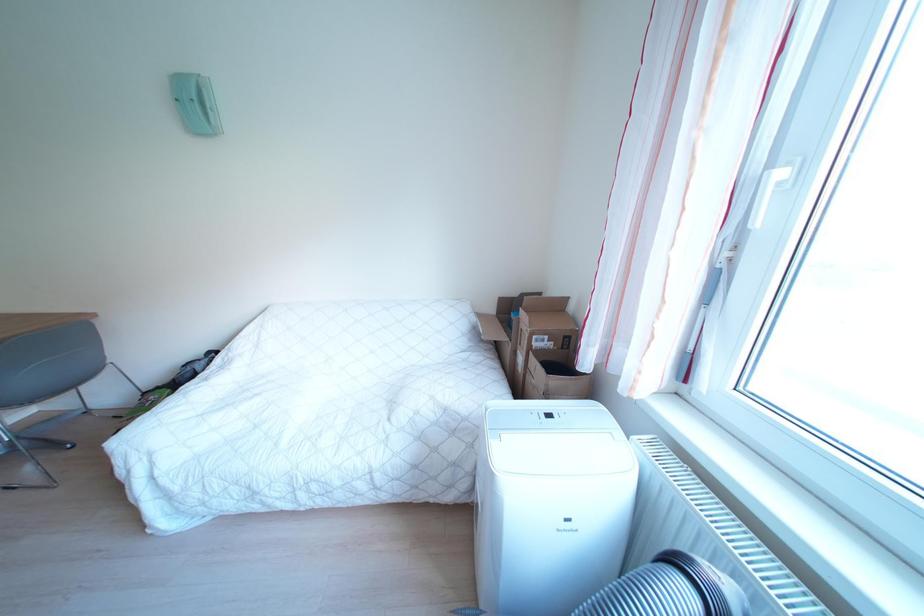
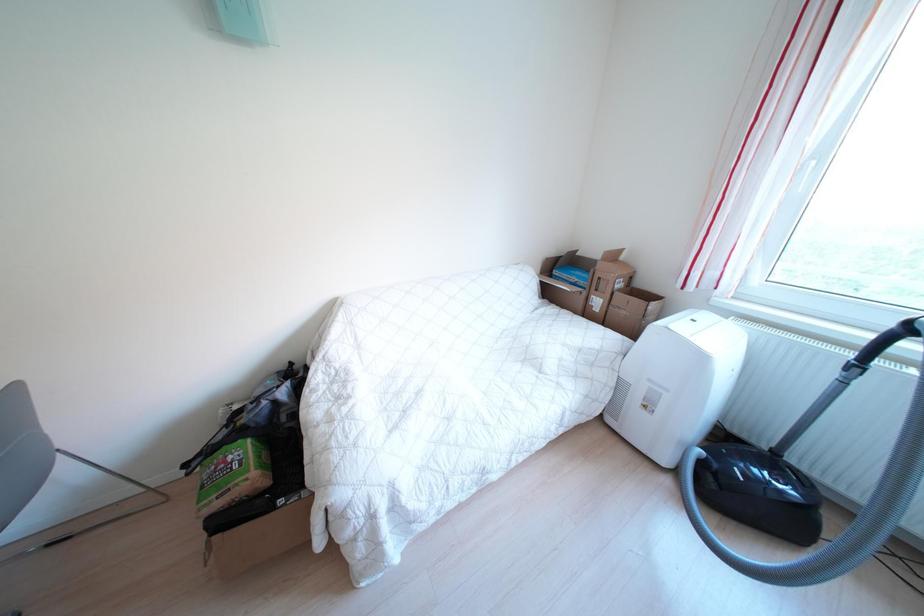
Question: Which direction would the cameraman need to move to produce the second image? Reply with the corresponding letter.

Choices:
 (A) Left
 (B) Right
 (C) Forward
 (D) Backward

Answer: (A)